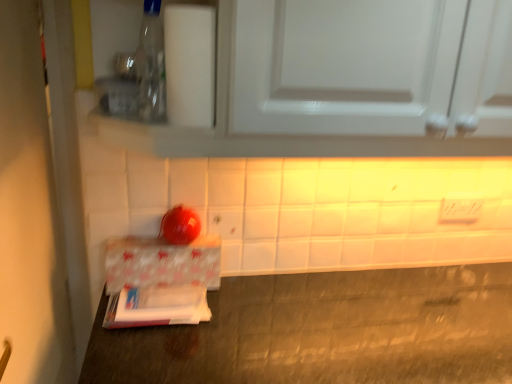
Question: From the image's perspective, relative to white glossy door at left, is transparent plastic bottle at upper left above or below?

Choices:
 (A) below
 (B) above

Answer: (B)

Question: From a real-world perspective, is transparent plastic bottle at upper left positioned above or below white glossy door at left?

Choices:
 (A) below
 (B) above

Answer: (B)

Question: Which is nearer to the white plastic electric outlet at center?

Choices:
 (A) white glossy cabinet at upper center
 (B) transparent plastic bottle at upper left
 (C) white glossy door at left
 (D) patterned paperboard at lower left

Answer: (A)

Question: Which object is the farthest from the white glossy door at left?

Choices:
 (A) white plastic electric outlet at center
 (B) white glossy cabinet at upper center
 (C) patterned paperboard at lower left
 (D) transparent plastic bottle at upper left

Answer: (A)